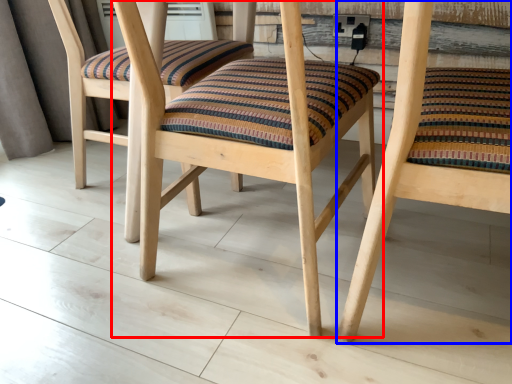
Question: Which point is closer to the camera, chair (highlighted by a red box) or chair (highlighted by a blue box)?

Choices:
 (A) chair
 (B) chair

Answer: (B)